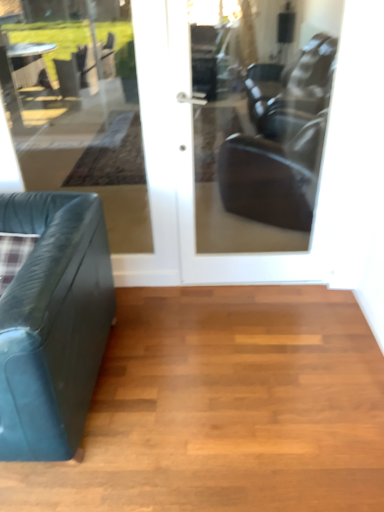
Question: Relative to shiny brown hardwood floor at lower left, is matte glass door at center in front or behind?

Choices:
 (A) behind
 (B) front

Answer: (A)

Question: Is matte glass door at center to the left or to the right of shiny brown hardwood floor at lower left in the image?

Choices:
 (A) left
 (B) right

Answer: (B)

Question: Which is nearer to the transparent glass door at center?

Choices:
 (A) teal leather studio couch at left
 (B) shiny brown hardwood floor at lower left
 (C) matte glass door at center

Answer: (C)

Question: Which object is the farthest from the transparent glass door at center?

Choices:
 (A) matte glass door at center
 (B) shiny brown hardwood floor at lower left
 (C) teal leather studio couch at left

Answer: (B)